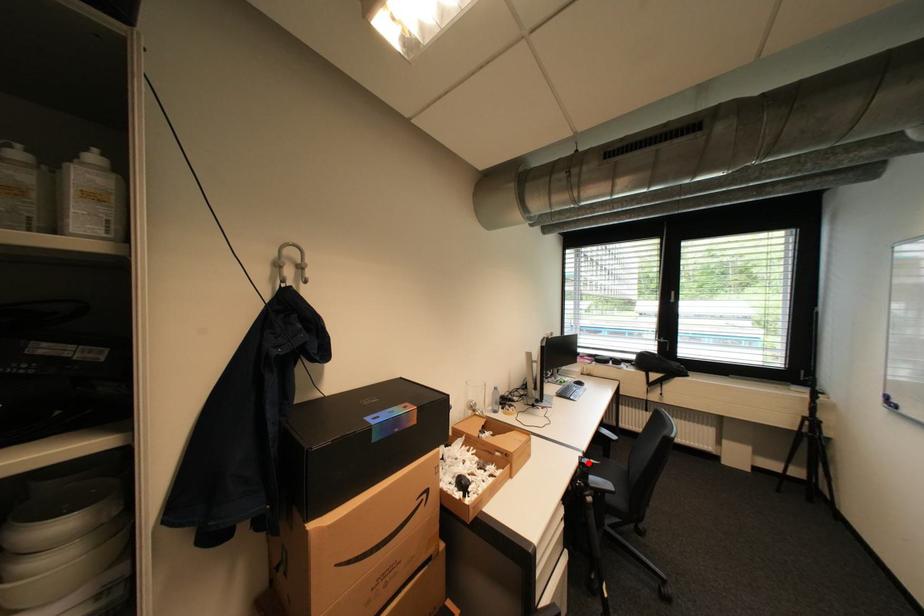
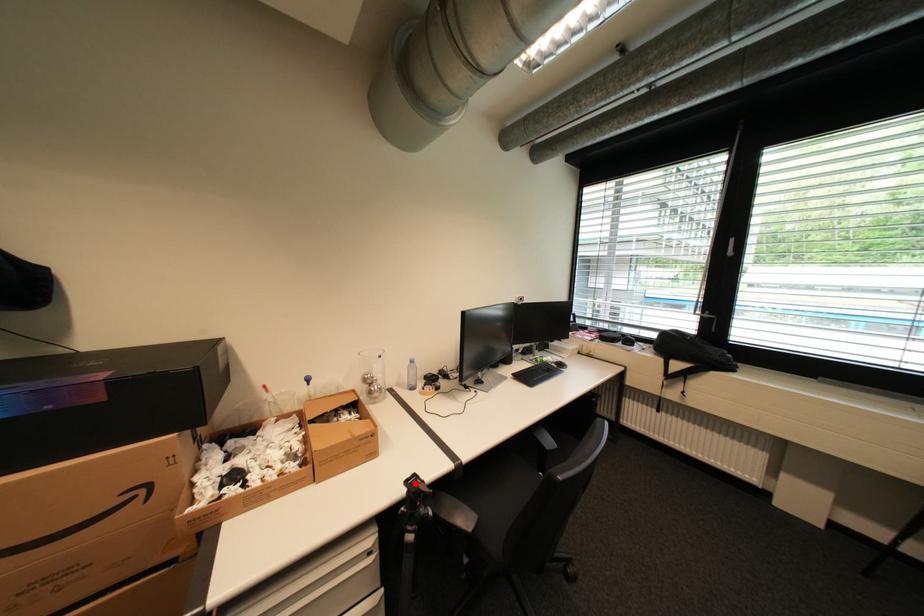
I am providing you with two images of the same scene from different viewpoints. A red point is marked on the first image and another point is marked on the second image. Are the points marked in image1 and image2 representing the same 3D position?

Yes